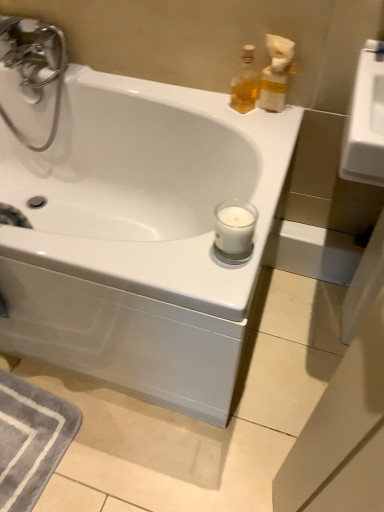
I want to click on vacant space that is to the left of translucent plastic soap dispenser at upper right, acting as the 2th soap dispenser starting from the left, so click(x=222, y=108).